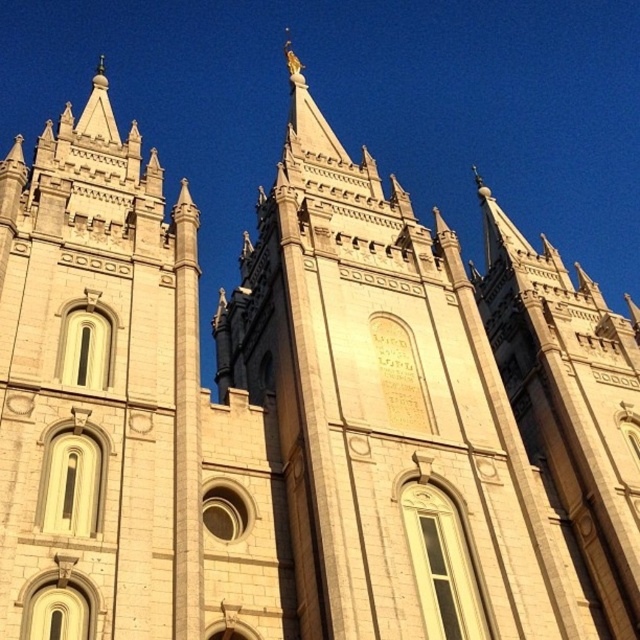
You are an architect examining the temple structure. You need to determine which tower has a greater width between the white stone tower at center and the beige stone tower at right based on the given scene description.

The white stone tower at center has a greater width than the beige stone tower at right as stated in the object description.

You are standing in front of the temple and notice two towers. The white stone tower at center and the beige stone tower at right. Which tower is positioned higher in the image?

The white stone tower at center is positioned higher than the beige stone tower at right as it is located above it in the image.

You are standing in front of the temple and notice two points marked on the structure. The first point is at coordinate point (93,512) and the second is at point (556,314). Which point is closer to you?

Point (93,512) is closer to the viewer than point (556,314).